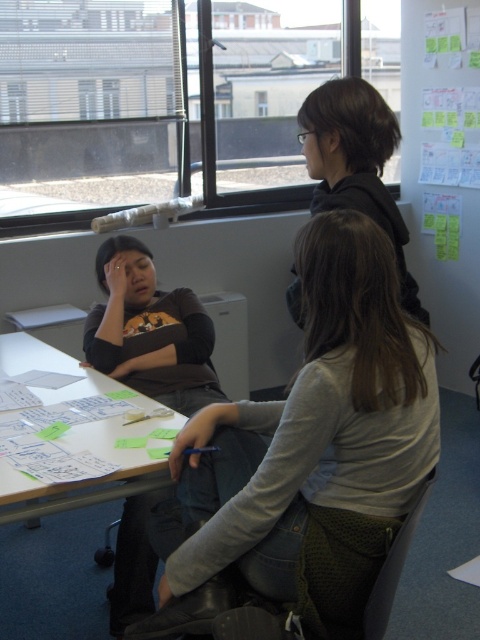
Is transparent glass window at upper center above white paper at center?

Yes, transparent glass window at upper center is above white paper at center.

What do you see at coordinates (163, 104) in the screenshot?
I see `transparent glass window at upper center` at bounding box center [163, 104].

This screenshot has height=640, width=480. Identify the location of transparent glass window at upper center. (163, 104).

Is transparent glass window at upper left to the right of white paper at center from the viewer's perspective?

Incorrect, transparent glass window at upper left is not on the right side of white paper at center.

Find the location of `transparent glass window at upper left`. transparent glass window at upper left is located at coordinates tap(88, 104).

What do you see at coordinates (88, 104) in the screenshot?
I see `transparent glass window at upper left` at bounding box center [88, 104].

Image resolution: width=480 pixels, height=640 pixels. Find the location of `transparent glass window at upper left`. transparent glass window at upper left is located at coordinates (88, 104).

Between transparent glass window at upper center and matte brown shirt at center, which one appears on the right side from the viewer's perspective?

From the viewer's perspective, transparent glass window at upper center appears more on the right side.

Consider the image. Can you confirm if transparent glass window at upper center is positioned to the right of matte brown shirt at center?

Yes, transparent glass window at upper center is to the right of matte brown shirt at center.

Is point (326, 76) closer to camera compared to point (202, 396)?

That is False.

Where is `transparent glass window at upper center`? The image size is (480, 640). transparent glass window at upper center is located at coordinates (163, 104).